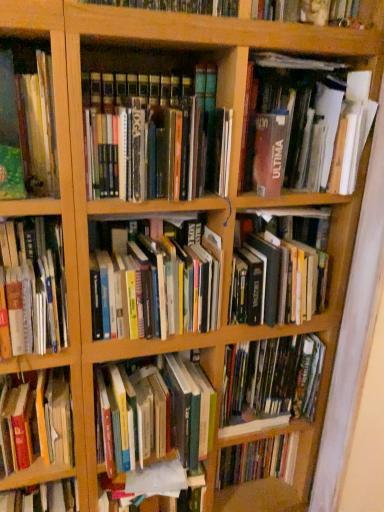
Question: Is hardcover book at left, which is counted as the 4th book, starting from the bottom, wider or thinner than hardcover books at center, positioned as the 8th book in top-to-bottom order?

Choices:
 (A) wide
 (B) thin

Answer: (B)

Question: Considering the positions of hardcover book at left, which appears as the 6th book when viewed from the top, and hardcover books at center, positioned as the 8th book in top-to-bottom order, in the image, is hardcover book at left, which appears as the 6th book when viewed from the top, taller or shorter than hardcover books at center, positioned as the 8th book in top-to-bottom order,?

Choices:
 (A) tall
 (B) short

Answer: (A)

Question: Which object is the closest to the green matte book at left, the second book in the top-to-bottom sequence?

Choices:
 (A) hardcover books at center, positioned as the 8th book in top-to-bottom order
 (B) matte brown book at upper right, the ninth book ordered from the bottom
 (C) hardcover book at center, the third book from the bottom
 (D) hardcover books at center, the 5th book positioned from the top
 (E) hardcover book at left, the 9th book in the top-to-bottom sequence

Answer: (D)

Question: Which object is the farthest from the hardcover books at center, which is the 5th book from bottom to top?

Choices:
 (A) hardcover book at center, which is the sixth book from bottom to top
 (B) green matte book at left, positioned as the 8th book in bottom-to-top order
 (C) hardcover books at center, positioned as the 7th book in bottom-to-top order
 (D) hardcover book at left, which appears as the 6th book when viewed from the top
 (E) hardcover books at center, which is the 2th book in bottom-to-top order

Answer: (B)